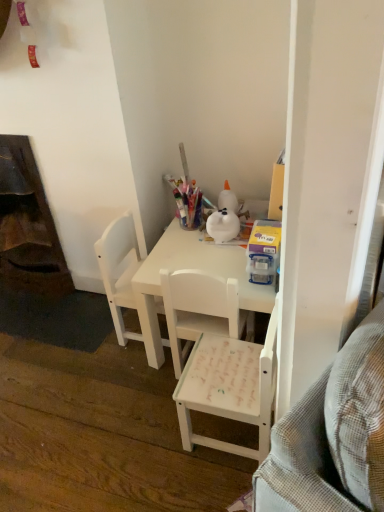
Question: Can you confirm if white matte desk at center is shorter than white matte chair at center, which is the 3th chair in left-to-right order?

Choices:
 (A) no
 (B) yes

Answer: (B)

Question: Is white matte desk at center positioned far away from white matte chair at center, which is the 3th chair in left-to-right order?

Choices:
 (A) yes
 (B) no

Answer: (B)

Question: Is white matte desk at center oriented towards white matte chair at center, which is counted as the 1th chair, starting from the right?

Choices:
 (A) no
 (B) yes

Answer: (A)

Question: From a real-world perspective, is white matte desk at center below white matte chair at center, which is counted as the 1th chair, starting from the right?

Choices:
 (A) no
 (B) yes

Answer: (B)

Question: Is white matte desk at center bigger than white matte chair at center, which is the 3th chair in left-to-right order?

Choices:
 (A) no
 (B) yes

Answer: (B)

Question: Is white matte desk at center oriented away from white matte chair at center, which is the 3th chair in left-to-right order?

Choices:
 (A) yes
 (B) no

Answer: (B)

Question: Is white matte chair at center, acting as the first chair starting from the left, touching translucent plastic container at upper right?

Choices:
 (A) no
 (B) yes

Answer: (A)

Question: Is white matte chair at center, acting as the first chair starting from the left, positioned beyond the bounds of translucent plastic container at upper right?

Choices:
 (A) yes
 (B) no

Answer: (A)

Question: Are white matte chair at center, which is counted as the third chair, starting from the right, and translucent plastic container at upper right located far from each other?

Choices:
 (A) yes
 (B) no

Answer: (B)

Question: Does white matte chair at center, which is counted as the third chair, starting from the right, have a greater height compared to translucent plastic container at upper right?

Choices:
 (A) yes
 (B) no

Answer: (A)

Question: Does white matte chair at center, acting as the first chair starting from the left, have a lesser height compared to translucent plastic container at upper right?

Choices:
 (A) yes
 (B) no

Answer: (B)

Question: From the image's perspective, is white matte chair at center, acting as the first chair starting from the left, located beneath translucent plastic container at upper right?

Choices:
 (A) yes
 (B) no

Answer: (A)

Question: Does white matte chair at center, placed as the second chair when sorted from right to left, have a lesser width compared to translucent plastic container at upper right?

Choices:
 (A) yes
 (B) no

Answer: (B)